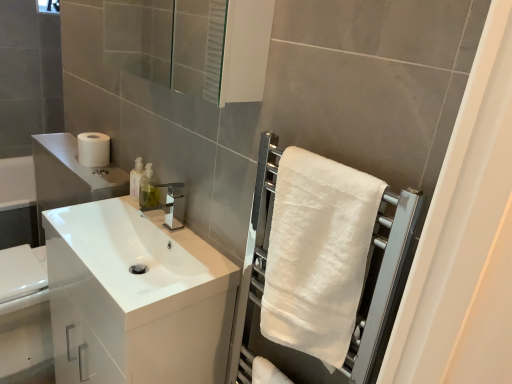
What do you see at coordinates (169, 42) in the screenshot? The image size is (512, 384). I see `transparent glass mirror at upper center` at bounding box center [169, 42].

Image resolution: width=512 pixels, height=384 pixels. Describe the element at coordinates (135, 297) in the screenshot. I see `white glossy cabinet at left` at that location.

In order to click on translucent plastic soap dispenser at upper center in this screenshot , I will do point(136,178).

The width and height of the screenshot is (512, 384). Find the location of `transparent glass mirror at upper center`. transparent glass mirror at upper center is located at coordinates (169, 42).

Considering the relative sizes of white glossy cabinet at left and white matte toilet paper at left in the image provided, is white glossy cabinet at left thinner than white matte toilet paper at left?

Answer: No.

Is the depth of white glossy cabinet at left greater than that of white matte toilet paper at left?

No, the depth of white glossy cabinet at left is less than that of white matte toilet paper at left.

From their relative heights in the image, would you say white glossy cabinet at left is taller or shorter than white matte toilet paper at left?

Clearly, white glossy cabinet at left is taller compared to white matte toilet paper at left.

Would you say white matte toilet paper at left is part of white glossy cabinet at left's contents?

No, white glossy cabinet at left does not contain white matte toilet paper at left.

From a real-world perspective, who is located higher, white glossy cabinet at left or translucent plastic soap dispenser at upper center?

translucent plastic soap dispenser at upper center.

Looking at the image, does white glossy cabinet at left seem bigger or smaller compared to translucent plastic soap dispenser at upper center?

white glossy cabinet at left is bigger than translucent plastic soap dispenser at upper center.

In the image, is white glossy cabinet at left positioned in front of or behind translucent plastic soap dispenser at upper center?

Clearly, white glossy cabinet at left is in front of translucent plastic soap dispenser at upper center.

Is transparent glass mirror at upper center surrounding white soft towel at right?

Actually, white soft towel at right is outside transparent glass mirror at upper center.

Is point (153, 72) less distant than point (311, 301)?

No, it is not.

Is transparent glass mirror at upper center oriented away from white soft towel at right?

No, transparent glass mirror at upper center is not facing the opposite direction of white soft towel at right.

From a real-world perspective, is transparent glass mirror at upper center over white soft towel at right?

Indeed, from a real-world perspective, transparent glass mirror at upper center stands above white soft towel at right.

Which object is wider, translucent plastic soap dispenser at center or white matte toilet paper at left?

white matte toilet paper at left is wider.

Which is behind, point (149, 199) or point (80, 149)?

The point (80, 149) is more distant.

Is the position of translucent plastic soap dispenser at center less distant than that of white matte toilet paper at left?

Yes, the depth of translucent plastic soap dispenser at center is less than that of white matte toilet paper at left.

Between translucent plastic soap dispenser at center and white matte toilet paper at left, which one has smaller size?

Smaller between the two is translucent plastic soap dispenser at center.

Is translucent plastic soap dispenser at upper center at the right side of translucent plastic soap dispenser at center?

In fact, translucent plastic soap dispenser at upper center is to the left of translucent plastic soap dispenser at center.

Consider the image. Measure the distance from translucent plastic soap dispenser at upper center to translucent plastic soap dispenser at center.

translucent plastic soap dispenser at upper center is 1.59 inches away from translucent plastic soap dispenser at center.

Are translucent plastic soap dispenser at upper center and translucent plastic soap dispenser at center located far from each other?

No, there isn't a large distance between translucent plastic soap dispenser at upper center and translucent plastic soap dispenser at center.

From a real-world perspective, is translucent plastic soap dispenser at upper center above or below translucent plastic soap dispenser at center?

translucent plastic soap dispenser at upper center is below translucent plastic soap dispenser at center.

Based on the photo, which of these two, translucent plastic soap dispenser at center or white glossy cabinet at left, is bigger?

white glossy cabinet at left is bigger.

Would you say translucent plastic soap dispenser at center is a long distance from white glossy cabinet at left?

Actually, translucent plastic soap dispenser at center and white glossy cabinet at left are a little close together.

Considering the sizes of objects translucent plastic soap dispenser at center and white glossy cabinet at left in the image provided, who is thinner, translucent plastic soap dispenser at center or white glossy cabinet at left?

translucent plastic soap dispenser at center.

In order to click on bathroom cabinet located in front of the translucent plastic soap dispenser at center in this screenshot , I will do `click(135, 297)`.

Would you say white soft towel at right is a long distance from white glossy cabinet at left?

No, white soft towel at right is not far from white glossy cabinet at left.

Does white soft towel at right have a larger size compared to white glossy cabinet at left?

Incorrect, white soft towel at right is not larger than white glossy cabinet at left.

Where is `bathroom cabinet below the white matte toilet paper at left (from a real-world perspective)`? The width and height of the screenshot is (512, 384). bathroom cabinet below the white matte toilet paper at left (from a real-world perspective) is located at coordinates (135, 297).

At what (x,y) coordinates should I click in order to perform the action: click on toiletry that is above the white glossy cabinet at left (from the image's perspective). Please return your answer as a coordinate pair (x, y). Looking at the image, I should click on (136, 178).

Based on their spatial positions, is translucent plastic soap dispenser at center or white glossy cabinet at left further from white matte toilet paper at left?

white glossy cabinet at left is positioned further to the anchor white matte toilet paper at left.

Looking at the image, which one is located further to transparent glass mirror at upper center, white soft towel at right or translucent plastic soap dispenser at upper center?

white soft towel at right.

Based on their spatial positions, is white glossy cabinet at left or white soft towel at right closer to transparent glass mirror at upper center?

The object closer to transparent glass mirror at upper center is white glossy cabinet at left.

From the image, which object appears to be farther from translucent plastic soap dispenser at center, white matte toilet paper at left or translucent plastic soap dispenser at upper center?

white matte toilet paper at left is positioned further to the anchor translucent plastic soap dispenser at center.

From the image, which object appears to be nearer to white glossy cabinet at left, white matte toilet paper at left or translucent plastic soap dispenser at center?

Among the two, translucent plastic soap dispenser at center is located nearer to white glossy cabinet at left.

Looking at the image, which one is located closer to transparent glass mirror at upper center, white glossy cabinet at left or translucent plastic soap dispenser at upper center?

translucent plastic soap dispenser at upper center.

Based on their spatial positions, is translucent plastic soap dispenser at center or white soft towel at right further from white glossy cabinet at left?

The object further to white glossy cabinet at left is white soft towel at right.

When comparing their distances from translucent plastic soap dispenser at center, does white soft towel at right or white matte toilet paper at left seem further?

white soft towel at right is positioned further to the anchor translucent plastic soap dispenser at center.

Where is `soap dispenser between transparent glass mirror at upper center and white matte toilet paper at left from front to back`? This screenshot has width=512, height=384. soap dispenser between transparent glass mirror at upper center and white matte toilet paper at left from front to back is located at coordinates (147, 189).

Locate an element on the screen. toiletry between transparent glass mirror at upper center and white matte toilet paper at left from front to back is located at coordinates (136, 178).

The width and height of the screenshot is (512, 384). What are the coordinates of `toiletry located between white soft towel at right and white matte toilet paper at left in the depth direction` in the screenshot? It's located at (136, 178).

Where is `toiletry that lies between transparent glass mirror at upper center and white glossy cabinet at left from top to bottom`? toiletry that lies between transparent glass mirror at upper center and white glossy cabinet at left from top to bottom is located at coordinates (136, 178).